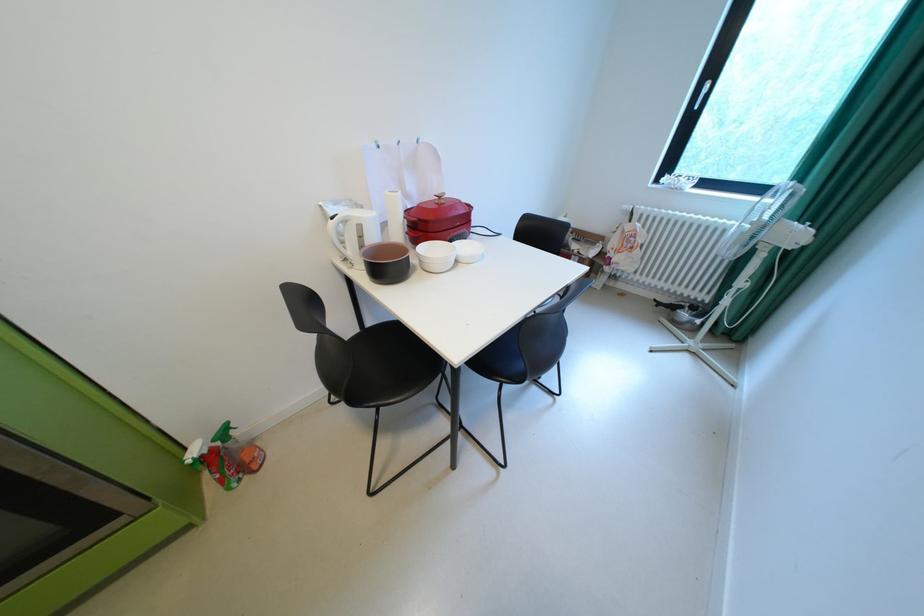
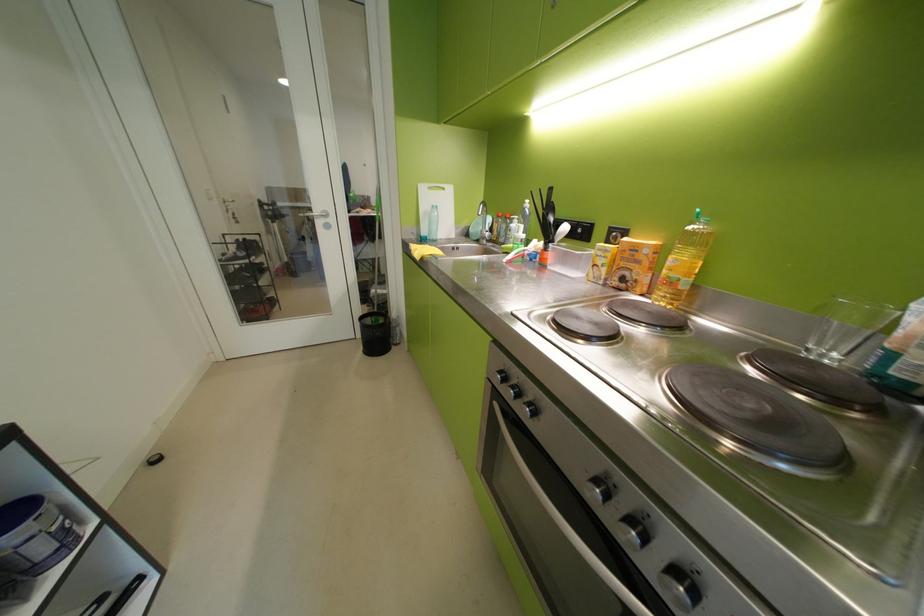
The first image is from the beginning of the video and the second image is from the end. How did the camera likely rotate when shooting the video?

The camera's rotation is toward left-down.